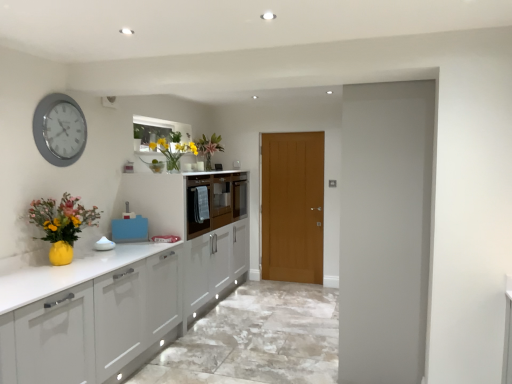
Question: From the image's perspective, is translucent glass vase at upper center, the second floral arrangement from the bottom, beneath matte yellow vase at lower left, the third floral arrangement positioned from the top?

Choices:
 (A) yes
 (B) no

Answer: (B)

Question: Are translucent glass vase at upper center, the second floral arrangement from the front, and matte yellow vase at lower left, the third floral arrangement when ordered from back to front, beside each other?

Choices:
 (A) yes
 (B) no

Answer: (B)

Question: Can you confirm if translucent glass vase at upper center, the second floral arrangement from the front, is shorter than matte yellow vase at lower left, the third floral arrangement when ordered from back to front?

Choices:
 (A) yes
 (B) no

Answer: (A)

Question: Considering the relative sizes of translucent glass vase at upper center, positioned as the second floral arrangement in top-to-bottom order, and matte yellow vase at lower left, which is counted as the first floral arrangement, starting from the left, in the image provided, is translucent glass vase at upper center, positioned as the second floral arrangement in top-to-bottom order, smaller than matte yellow vase at lower left, which is counted as the first floral arrangement, starting from the left,?

Choices:
 (A) yes
 (B) no

Answer: (A)

Question: Is matte yellow vase at lower left, the third floral arrangement positioned from the top, completely or partially inside translucent glass vase at upper center, the 2th floral arrangement positioned from the back?

Choices:
 (A) no
 (B) yes

Answer: (A)

Question: From a real-world perspective, does translucent glass vase at upper center, positioned as the second floral arrangement in top-to-bottom order, sit lower than matte yellow vase at lower left, the first floral arrangement in the front-to-back sequence?

Choices:
 (A) no
 (B) yes

Answer: (A)

Question: Is blue plastic container at center positioned with its back to translucent glass vase at upper center, the second floral arrangement from the front?

Choices:
 (A) no
 (B) yes

Answer: (A)

Question: Is blue plastic container at center bigger than translucent glass vase at upper center, positioned as the second floral arrangement in top-to-bottom order?

Choices:
 (A) no
 (B) yes

Answer: (A)

Question: Is translucent glass vase at upper center, the second floral arrangement from the bottom, surrounded by blue plastic container at center?

Choices:
 (A) yes
 (B) no

Answer: (B)

Question: From a real-world perspective, is blue plastic container at center on translucent glass vase at upper center, the second floral arrangement from the bottom?

Choices:
 (A) no
 (B) yes

Answer: (A)

Question: Is blue plastic container at center touching translucent glass vase at upper center, acting as the second floral arrangement starting from the left?

Choices:
 (A) yes
 (B) no

Answer: (B)

Question: Considering the relative sizes of blue plastic container at center and translucent glass vase at upper center, the second floral arrangement from the front, in the image provided, is blue plastic container at center smaller than translucent glass vase at upper center, the second floral arrangement from the front,?

Choices:
 (A) no
 (B) yes

Answer: (B)

Question: Does matte white cabinetry at center have a smaller size compared to matte wood door at center?

Choices:
 (A) no
 (B) yes

Answer: (A)